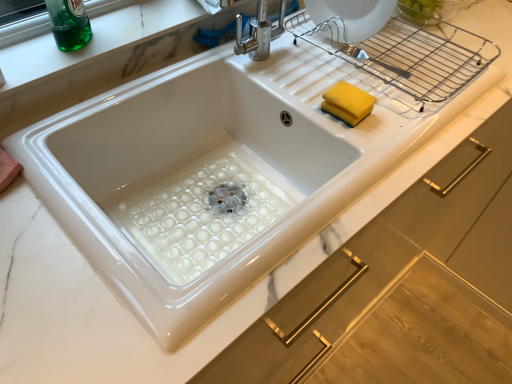
Where is `green glass bottle at upper left`? The height and width of the screenshot is (384, 512). green glass bottle at upper left is located at coordinates (69, 24).

At what (x,y) coordinates should I click in order to perform the action: click on yellow sponge at upper right. Please return your answer as a coordinate pair (x, y). This screenshot has height=384, width=512. Looking at the image, I should click on (348, 103).

Would you say white glossy sink at center is inside or outside yellow sponge at upper right?

white glossy sink at center is located beyond the bounds of yellow sponge at upper right.

Identify the location of food above the white glossy sink at center (from a real-world perspective). (348, 103).

Based on the photo, can you confirm if white glossy sink at center is positioned to the left of yellow sponge at upper right?

Correct, you'll find white glossy sink at center to the left of yellow sponge at upper right.

Looking at this image, is white glossy sink at center located within green glass bottle at upper left?

No, white glossy sink at center is not a part of green glass bottle at upper left.

From the picture: Is green glass bottle at upper left positioned behind white glossy sink at center?

Yes, green glass bottle at upper left is further from the viewer.

Is green glass bottle at upper left next to white glossy sink at center and touching it?

They are not placed beside each other.

Can you tell me how much green glass bottle at upper left and white glossy sink at center differ in facing direction?

The angular difference between green glass bottle at upper left and white glossy sink at center is 0.906 degrees.

Is yellow sponge at upper right facing towards green glass bottle at upper left?

No, yellow sponge at upper right does not turn towards green glass bottle at upper left.

From a real-world perspective, who is located higher, yellow sponge at upper right or green glass bottle at upper left?

green glass bottle at upper left, from a real-world perspective.

Is yellow sponge at upper right far from green glass bottle at upper left?

Actually, yellow sponge at upper right and green glass bottle at upper left are a little close together.

From the image's perspective, which one is positioned higher, yellow sponge at upper right or green glass bottle at upper left?

green glass bottle at upper left appears higher in the image.

Is white glossy sink at center taller than green glass bottle at upper left?

In fact, white glossy sink at center may be shorter than green glass bottle at upper left.

From a real-world perspective, between white glossy sink at center and green glass bottle at upper left, who is vertically lower?

From a 3D spatial view, white glossy sink at center is below.

From the image's perspective, is white glossy sink at center located above green glass bottle at upper left?

Actually, white glossy sink at center appears below green glass bottle at upper left in the image.

In the scene shown: Is white glossy sink at center next to green glass bottle at upper left?

No.

The height and width of the screenshot is (384, 512). I want to click on food above the white glossy sink at center (from the image's perspective), so click(x=348, y=103).

Is white glossy sink at center completely or partially inside yellow sponge at upper right?

Definitely not — white glossy sink at center is not inside yellow sponge at upper right.

From a real-world perspective, is yellow sponge at upper right physically below white glossy sink at center?

No.

Is yellow sponge at upper right taller than white glossy sink at center?

Incorrect, the height of yellow sponge at upper right is not larger of that of white glossy sink at center.

Considering the sizes of objects green glass bottle at upper left and yellow sponge at upper right in the image provided, who is smaller, green glass bottle at upper left or yellow sponge at upper right?

Smaller between the two is yellow sponge at upper right.

Is point (76, 32) farther from camera compared to point (335, 84)?

No.

Who is taller, green glass bottle at upper left or yellow sponge at upper right?

green glass bottle at upper left.

The width and height of the screenshot is (512, 384). I want to click on food below the green glass bottle at upper left (from the image's perspective), so click(348, 103).

The width and height of the screenshot is (512, 384). In order to click on food behind the white glossy sink at center in this screenshot , I will do 348,103.

The height and width of the screenshot is (384, 512). In the image, there is a white glossy sink at center. In order to click on beverage above it (from the image's perspective) in this screenshot , I will do `click(69, 24)`.

Based on their spatial positions, is white glossy sink at center or green glass bottle at upper left further from yellow sponge at upper right?

Based on the image, green glass bottle at upper left appears to be further to yellow sponge at upper right.

From the image, which object appears to be farther from green glass bottle at upper left, yellow sponge at upper right or white glossy sink at center?

yellow sponge at upper right.

When comparing their distances from white glossy sink at center, does yellow sponge at upper right or green glass bottle at upper left seem closer?

The object closer to white glossy sink at center is yellow sponge at upper right.

Estimate the real-world distances between objects in this image. Which object is closer to green glass bottle at upper left, white glossy sink at center or yellow sponge at upper right?

The object closer to green glass bottle at upper left is white glossy sink at center.

Looking at the image, which one is located further to yellow sponge at upper right, green glass bottle at upper left or white glossy sink at center?

green glass bottle at upper left is further to yellow sponge at upper right.

Looking at the image, which one is located closer to white glossy sink at center, green glass bottle at upper left or yellow sponge at upper right?

Among the two, yellow sponge at upper right is located nearer to white glossy sink at center.

This screenshot has height=384, width=512. In order to click on sink between green glass bottle at upper left and yellow sponge at upper right in this screenshot , I will do `click(203, 171)`.